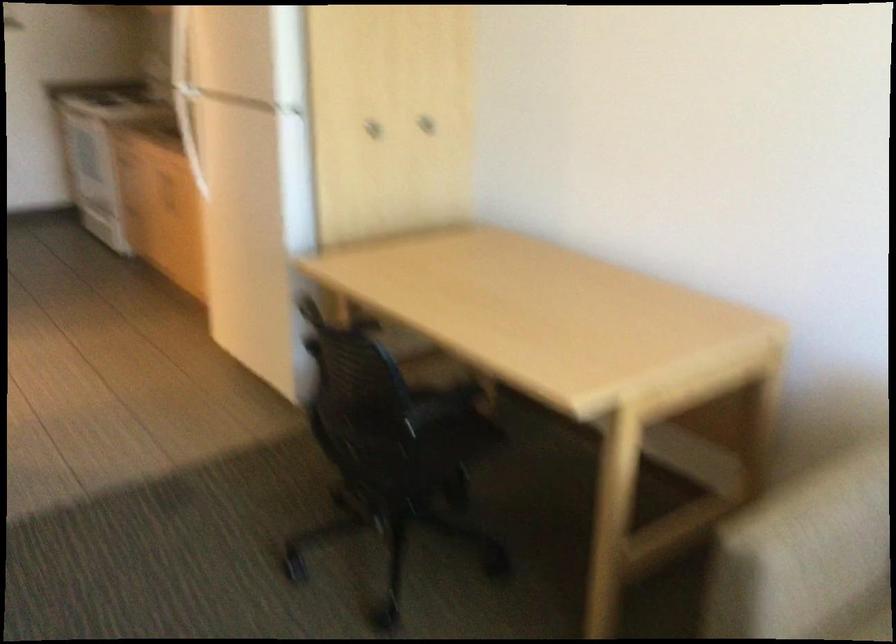
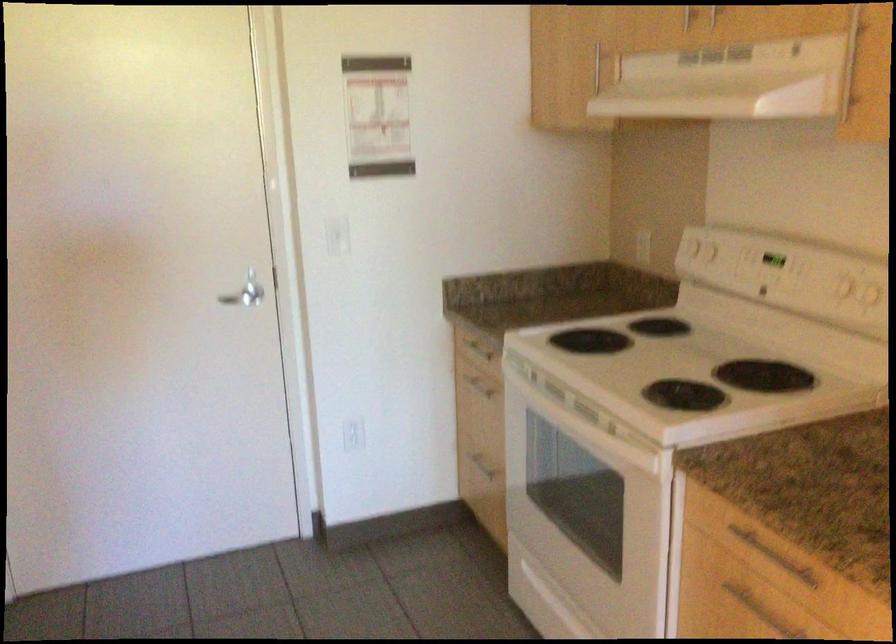
The images are taken continuously from a first-person perspective. In which direction are you moving?

The cameraman moved toward left, forward.